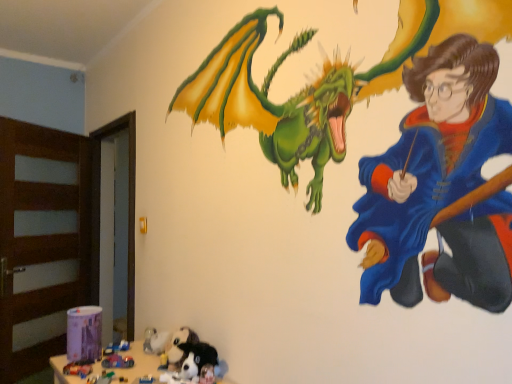
Question: Is point (129, 347) closer or farther from the camera than point (87, 362)?

Choices:
 (A) closer
 (B) farther

Answer: (B)

Question: Is plastic toy car at lower left, which is counted as the 1th toy, starting from the back, situated inside plastic toy car at lower left, which is the first toy from front to back, or outside?

Choices:
 (A) inside
 (B) outside

Answer: (B)

Question: Which is farther from the plastic toy car at lower left, which is counted as the 1th toy, starting from the back?

Choices:
 (A) plastic toy car at lower left, the third toy from the back
 (B) soft plush dog at lower center, which is the second animal from front to back
 (C) shiny plastic toy car at lower left, which is the second toy in front-to-back order
 (D) soft plush dog at lower center, marked as the first animal in a front-to-back arrangement

Answer: (D)

Question: Which is farther from the soft plush dog at lower center, placed as the first animal when sorted from back to front?

Choices:
 (A) soft plush dog at lower center, marked as the first animal in a front-to-back arrangement
 (B) shiny plastic toy car at lower left, the 2th toy when ordered from back to front
 (C) plastic toy car at lower left, which is the first toy from front to back
 (D) plastic toy car at lower left, which is counted as the 1th toy, starting from the back

Answer: (C)